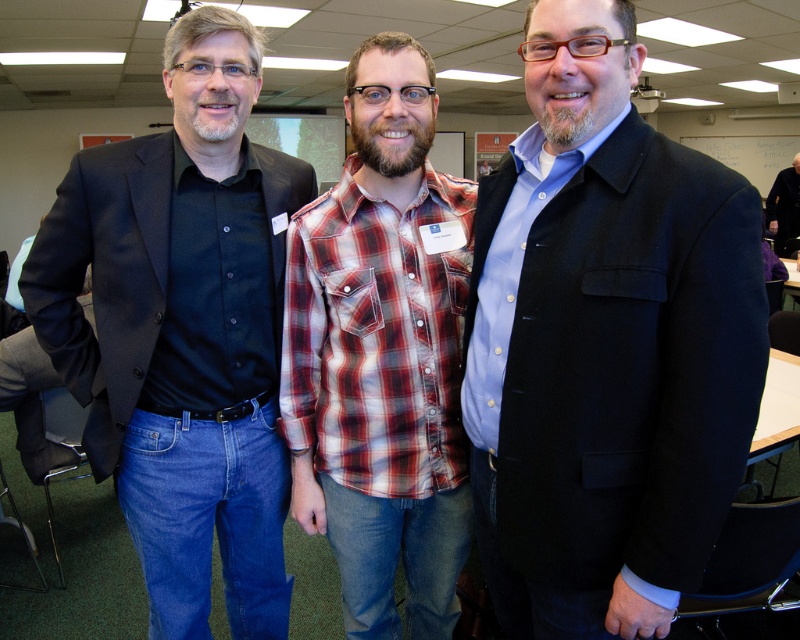
Does matte black coat at center appear on the right side of dark gray sweater at right?

In fact, matte black coat at center is to the left of dark gray sweater at right.

Is point (520, 227) closer to camera compared to point (778, 237)?

Yes.

Is point (598, 545) positioned in front of point (782, 196)?

Yes.

At what (x,y) coordinates should I click in order to perform the action: click on matte black coat at center. Please return your answer as a coordinate pair (x, y). This screenshot has width=800, height=640. Looking at the image, I should click on (605, 346).

Does matte black coat at center appear over plaid cotton shirt at center?

No.

Is point (521, 620) positioned after point (358, 330)?

Yes, point (521, 620) is behind point (358, 330).

What do you see at coordinates (605, 346) in the screenshot? I see `matte black coat at center` at bounding box center [605, 346].

This screenshot has height=640, width=800. Identify the location of matte black coat at center. (605, 346).

Is matte black coat at center further to the viewer compared to matte black shirt at left?

No, matte black coat at center is in front of matte black shirt at left.

Who is taller, matte black coat at center or matte black shirt at left?

matte black shirt at left is taller.

Identify the location of matte black coat at center. (605, 346).